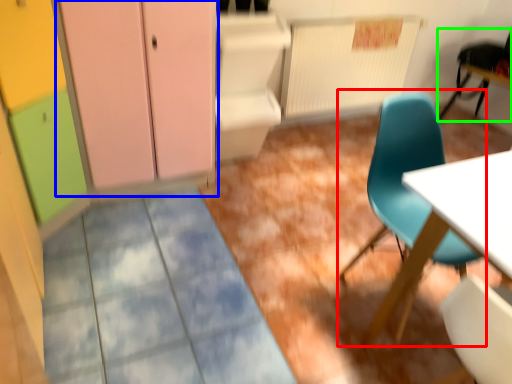
Question: Considering the real-world distances, which object is farthest from chair (highlighted by a red box)? dresser (highlighted by a blue box) or chair (highlighted by a green box)?

Choices:
 (A) dresser
 (B) chair

Answer: (B)